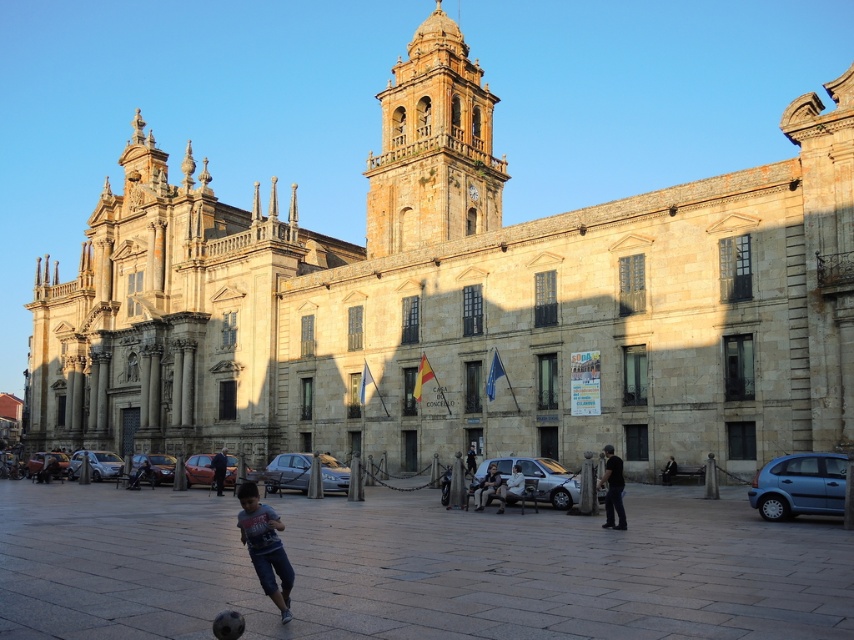
You are a photographer standing in front of the historic building with a blue cotton shirt at center and a dark brown leather jacket at center. You want to take a photo that includes both items without any overlap. Which item should you move to the side to make space?

The blue cotton shirt at center might be wider than the dark brown leather jacket at center, so moving the blue cotton shirt at center to the side would create more space to prevent overlap while capturing both items in the photo.